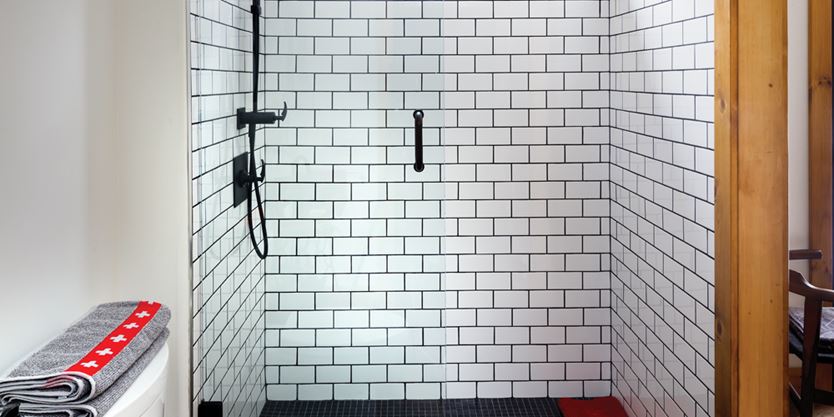
Find the location of a particular element. chair is located at coordinates (826, 307).